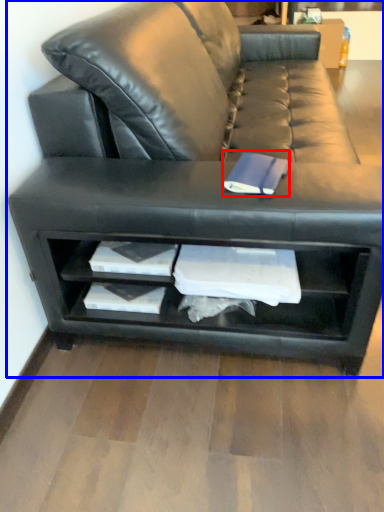
Question: Which point is further to the camera, paperback book (highlighted by a red box) or studio couch (highlighted by a blue box)?

Choices:
 (A) paperback book
 (B) studio couch

Answer: (A)